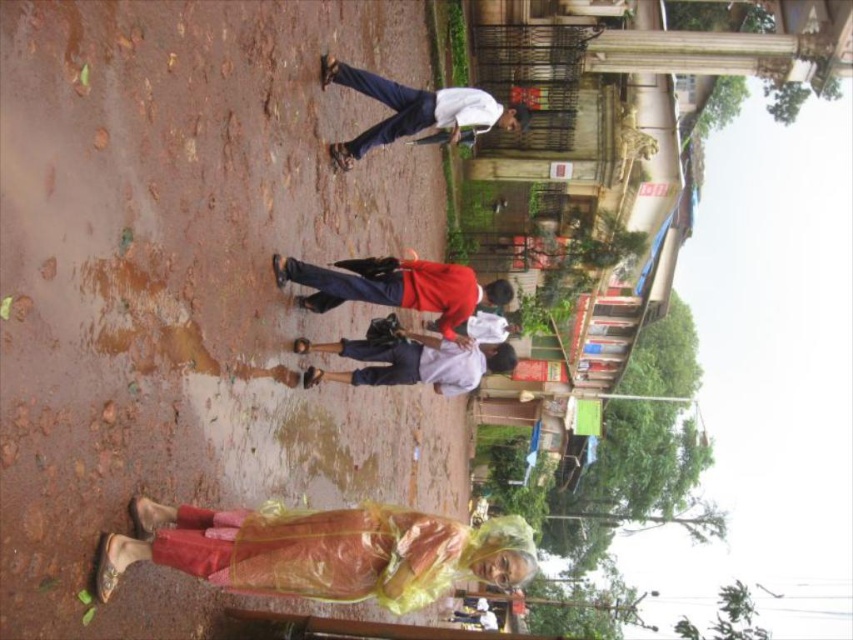
Can you confirm if translucent yellow raincoat at lower center is bigger than white cotton shirt at center?

Yes.

Who is lower down, translucent yellow raincoat at lower center or white cotton shirt at center?

translucent yellow raincoat at lower center

Is point (202, 579) positioned before point (398, 330)?

That is True.

Locate an element on the screen. This screenshot has width=853, height=640. translucent yellow raincoat at lower center is located at coordinates tap(322, 552).

Who is positioned more to the right, translucent yellow raincoat at lower center or red fabric shirt at center?

red fabric shirt at center

Is translucent yellow raincoat at lower center taller than red fabric shirt at center?

No.

Does point (434, 541) come closer to viewer compared to point (409, 272)?

Yes, point (434, 541) is in front of point (409, 272).

Where is `translucent yellow raincoat at lower center`? translucent yellow raincoat at lower center is located at coordinates (322, 552).

Which of these two, translucent yellow raincoat at lower center or white cotton shirt at upper center, stands shorter?

Standing shorter between the two is translucent yellow raincoat at lower center.

Between point (404, 582) and point (416, 113), which one is positioned in front?

Point (404, 582) is in front.

Where is `translucent yellow raincoat at lower center`? translucent yellow raincoat at lower center is located at coordinates (322, 552).